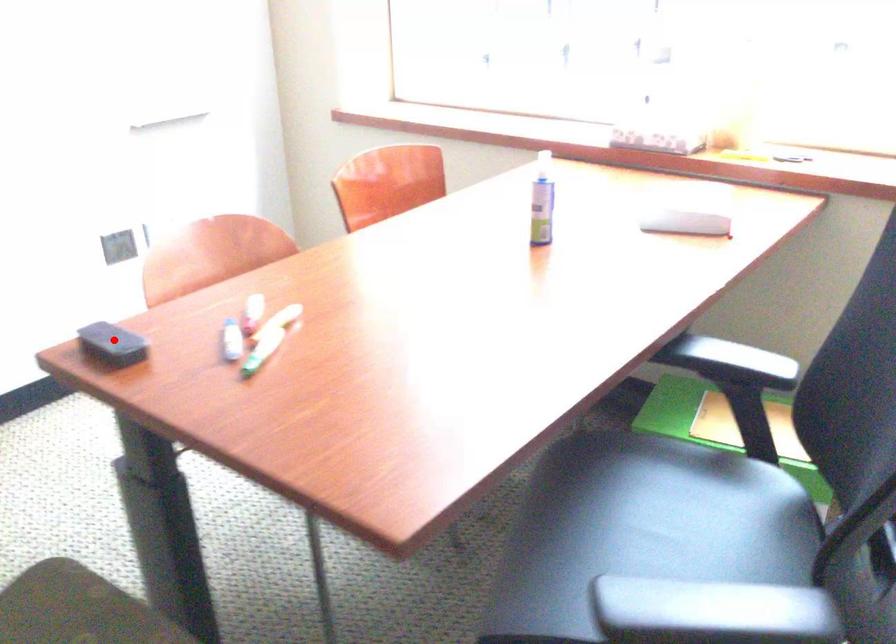
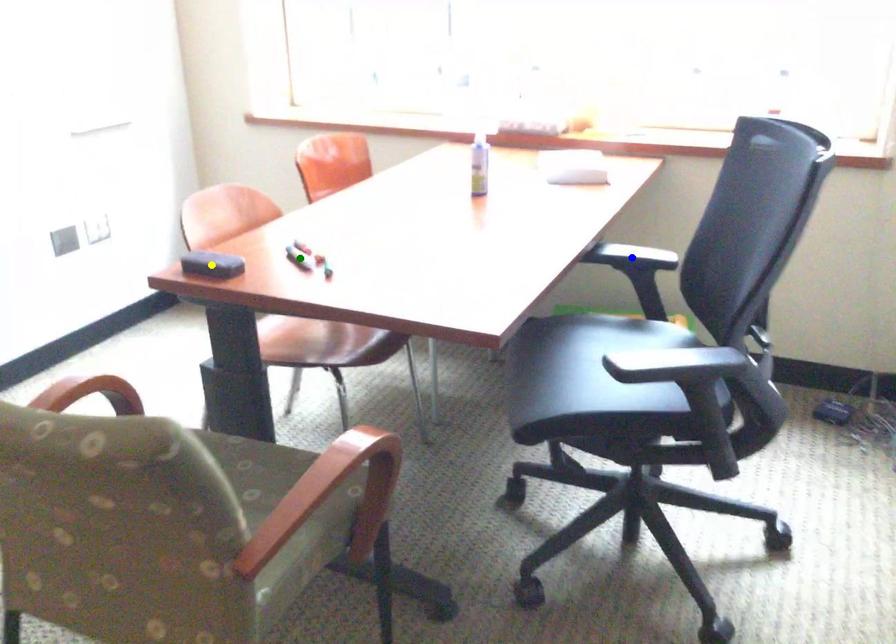
Question: I am providing you with two images of the same scene from different viewpoints. A red point is marked on the first image. You are given multiple points on the second image. Can you choose the point in image 2 that corresponds to the point in image 1?

Choices:
 (A) green point
 (B) yellow point
 (C) blue point

Answer: (B)